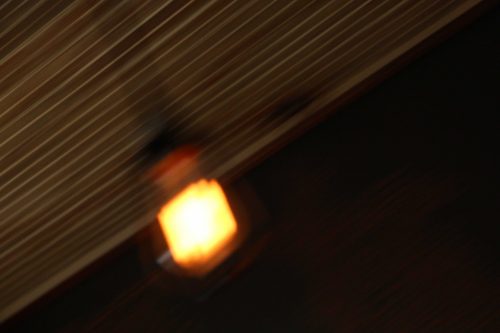
Where is `wall`? This screenshot has width=500, height=333. wall is located at coordinates (339, 291).